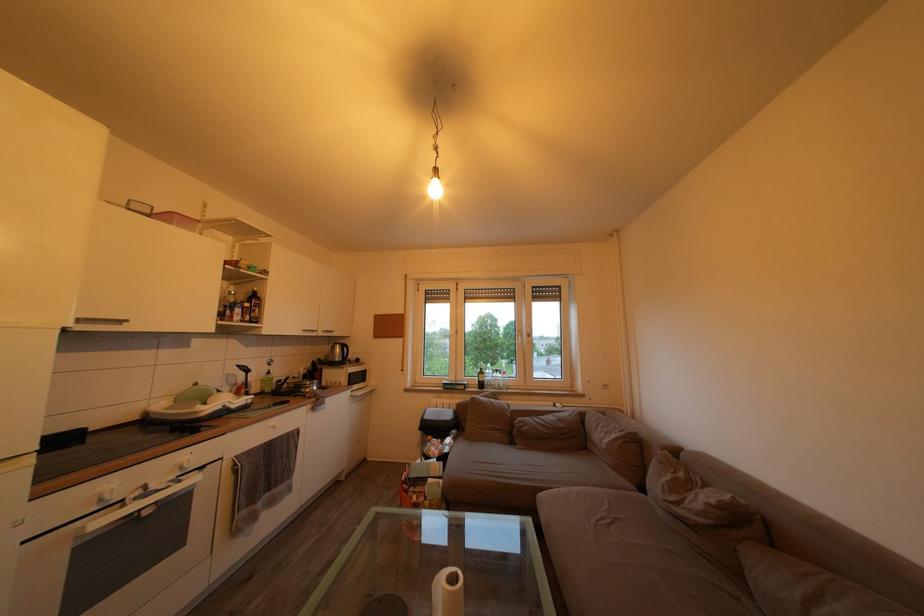
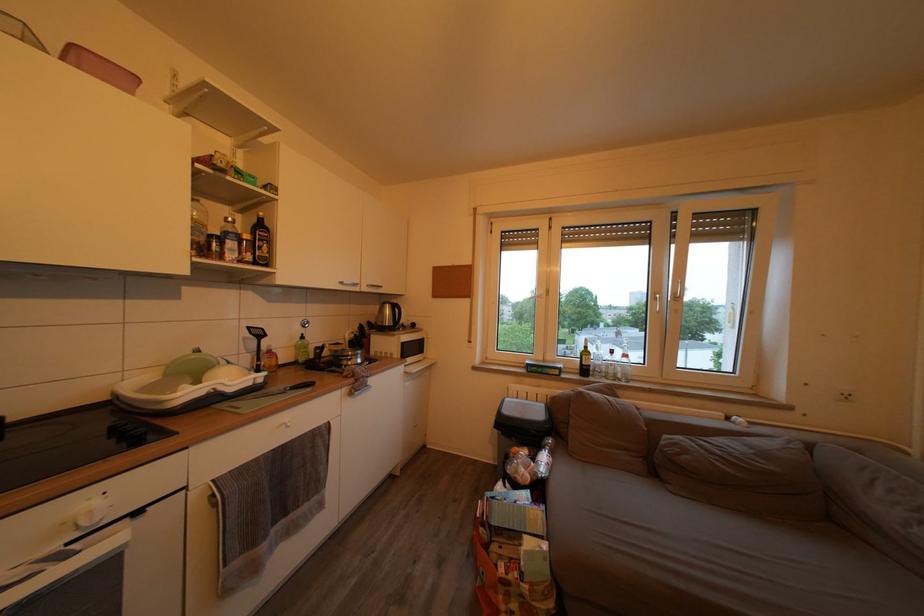
In the second image, find the point that corresponds to the point at 254,310 in the first image.

(253, 243)